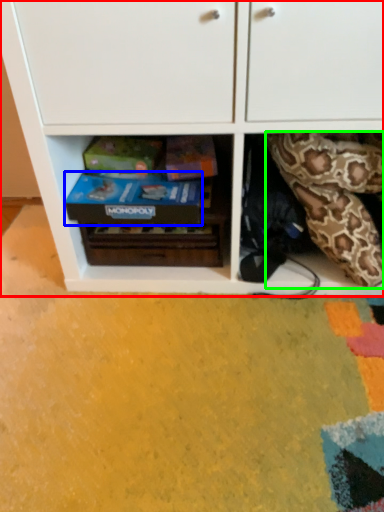
Question: Which object is the closest to the cabinetry (highlighted by a red box)? Choose among these: shoe box (highlighted by a blue box) or snake (highlighted by a green box).

Choices:
 (A) shoe box
 (B) snake

Answer: (A)